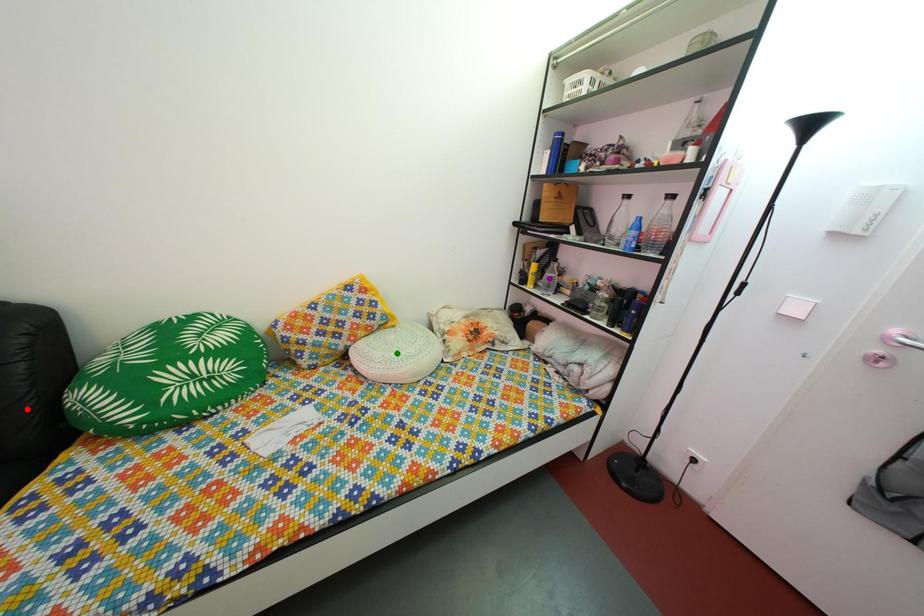
Based on the photo, order these from nearest to farthest:
- red point
- purple point
- green point

purple point < green point < red point